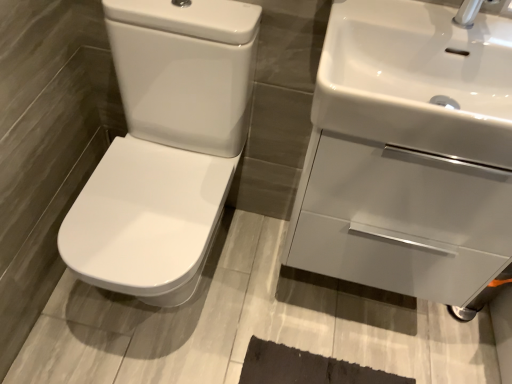
Where is `white glossy sink at upper right, which is counted as the 1th sink, starting from the front`? Image resolution: width=512 pixels, height=384 pixels. white glossy sink at upper right, which is counted as the 1th sink, starting from the front is located at coordinates (417, 80).

Where is `white glossy sink at upper right, the 2th sink viewed from the front`? The width and height of the screenshot is (512, 384). white glossy sink at upper right, the 2th sink viewed from the front is located at coordinates (408, 153).

Identify the location of white glossy sink at upper right, which is counted as the 1th sink, starting from the front. This screenshot has height=384, width=512. (417, 80).

Which object is closer to the camera, white glossy sink at upper right, which is the first sink in back-to-front order, or white glossy sink at upper right, which is counted as the 1th sink, starting from the front?

white glossy sink at upper right, which is counted as the 1th sink, starting from the front, is in front.

From the image's perspective, is white glossy sink at upper right, the 2th sink viewed from the front, located above white glossy sink at upper right, which appears as the second sink when viewed from the back?

No, from the image's perspective, white glossy sink at upper right, the 2th sink viewed from the front, is not above white glossy sink at upper right, which appears as the second sink when viewed from the back.

Where is `sink that is on the left side of white glossy sink at upper right, which is the first sink in back-to-front order`? This screenshot has width=512, height=384. sink that is on the left side of white glossy sink at upper right, which is the first sink in back-to-front order is located at coordinates (417, 80).

Is point (375, 76) more distant than point (434, 290)?

No, it is in front of (434, 290).

Does white glossy sink at upper right, which appears as the second sink when viewed from the back, have a greater height compared to white glossy sink at upper right, the 2th sink viewed from the front?

No, white glossy sink at upper right, which appears as the second sink when viewed from the back, is not taller than white glossy sink at upper right, the 2th sink viewed from the front.

Who is bigger, white glossy sink at upper right, the 2th sink viewed from the front, or white glossy toilet at left?

With larger size is white glossy toilet at left.

Measure the distance from white glossy sink at upper right, the 2th sink viewed from the front, to white glossy toilet at left.

They are 40.94 centimeters apart.

Is white glossy sink at upper right, which is the first sink in back-to-front order, facing towards white glossy toilet at left?

No, white glossy sink at upper right, which is the first sink in back-to-front order, is not aimed at white glossy toilet at left.

Consider the image. Is white glossy sink at upper right, which is the first sink in back-to-front order, taller than white glossy toilet at left?

Incorrect, the height of white glossy sink at upper right, which is the first sink in back-to-front order, is not larger of that of white glossy toilet at left.

Is white glossy toilet at left smaller than white glossy sink at upper right, which is counted as the 1th sink, starting from the front?

No.

Is white glossy toilet at left behind white glossy sink at upper right, which appears as the second sink when viewed from the back?

That is True.

Where is `toilet below the white glossy sink at upper right, which is counted as the 1th sink, starting from the front (from a real-world perspective)`? The image size is (512, 384). toilet below the white glossy sink at upper right, which is counted as the 1th sink, starting from the front (from a real-world perspective) is located at coordinates (165, 147).

From a real-world perspective, which is physically above, white glossy toilet at left or white glossy sink at upper right, which appears as the second sink when viewed from the back?

white glossy sink at upper right, which appears as the second sink when viewed from the back, is physically above.

Looking at the image, does white glossy sink at upper right, which is counted as the 1th sink, starting from the front, seem bigger or smaller compared to white glossy toilet at left?

In the image, white glossy sink at upper right, which is counted as the 1th sink, starting from the front, appears to be smaller than white glossy toilet at left.

Is there a large distance between white glossy sink at upper right, which appears as the second sink when viewed from the back, and white glossy toilet at left?

white glossy sink at upper right, which appears as the second sink when viewed from the back, is actually quite close to white glossy toilet at left.

Locate an element on the screen. The width and height of the screenshot is (512, 384). toilet below the white glossy sink at upper right, which appears as the second sink when viewed from the back (from a real-world perspective) is located at coordinates (165, 147).

How different are the orientations of white glossy sink at upper right, which appears as the second sink when viewed from the back, and white glossy toilet at left in degrees?

white glossy sink at upper right, which appears as the second sink when viewed from the back, and white glossy toilet at left are facing 0.44 degrees away from each other.

From a real-world perspective, does white glossy toilet at left stand above white glossy sink at upper right, which is the first sink in back-to-front order?

Incorrect, from a real-world perspective, white glossy toilet at left is lower than white glossy sink at upper right, which is the first sink in back-to-front order.

Considering the sizes of white glossy toilet at left and white glossy sink at upper right, which is the first sink in back-to-front order, in the image, is white glossy toilet at left taller or shorter than white glossy sink at upper right, which is the first sink in back-to-front order,?

Clearly, white glossy toilet at left is taller compared to white glossy sink at upper right, which is the first sink in back-to-front order.

Is there a large distance between white glossy toilet at left and white glossy sink at upper right, the 2th sink viewed from the front?

No, white glossy toilet at left is not far away from white glossy sink at upper right, the 2th sink viewed from the front.

From the image's perspective, would you say white glossy toilet at left is shown under white glossy sink at upper right, which is the first sink in back-to-front order?

Indeed, from the image's perspective, white glossy toilet at left is shown beneath white glossy sink at upper right, which is the first sink in back-to-front order.

This screenshot has height=384, width=512. In order to click on sink behind the white glossy sink at upper right, which is counted as the 1th sink, starting from the front in this screenshot , I will do (x=408, y=153).

Identify the location of sink to the right of white glossy sink at upper right, which is counted as the 1th sink, starting from the front. This screenshot has width=512, height=384. (408, 153).

Estimate the real-world distances between objects in this image. Which object is further from white glossy sink at upper right, the 2th sink viewed from the front, white glossy toilet at left or white glossy sink at upper right, which is counted as the 1th sink, starting from the front?

Among the two, white glossy toilet at left is located further to white glossy sink at upper right, the 2th sink viewed from the front.

When comparing their distances from white glossy toilet at left, does white glossy sink at upper right, which appears as the second sink when viewed from the back, or white glossy sink at upper right, which is the first sink in back-to-front order, seem further?

Based on the image, white glossy sink at upper right, which appears as the second sink when viewed from the back, appears to be further to white glossy toilet at left.

Considering their positions, is white glossy sink at upper right, which is counted as the 1th sink, starting from the front, positioned closer to white glossy sink at upper right, the 2th sink viewed from the front, than white glossy toilet at left?

white glossy sink at upper right, which is counted as the 1th sink, starting from the front, lies closer to white glossy sink at upper right, the 2th sink viewed from the front, than the other object.

Based on their spatial positions, is white glossy sink at upper right, the 2th sink viewed from the front, or white glossy sink at upper right, which is counted as the 1th sink, starting from the front, further from white glossy toilet at left?

white glossy sink at upper right, which is counted as the 1th sink, starting from the front.

Which object lies nearer to the anchor point white glossy sink at upper right, which appears as the second sink when viewed from the back, white glossy sink at upper right, the 2th sink viewed from the front, or white glossy toilet at left?

white glossy sink at upper right, the 2th sink viewed from the front, is closer to white glossy sink at upper right, which appears as the second sink when viewed from the back.

When comparing their distances from white glossy sink at upper right, which appears as the second sink when viewed from the back, does white glossy toilet at left or white glossy sink at upper right, the 2th sink viewed from the front, seem closer?

The object closer to white glossy sink at upper right, which appears as the second sink when viewed from the back, is white glossy sink at upper right, the 2th sink viewed from the front.

Image resolution: width=512 pixels, height=384 pixels. Find the location of `sink situated between white glossy toilet at left and white glossy sink at upper right, which is the first sink in back-to-front order, from left to right`. sink situated between white glossy toilet at left and white glossy sink at upper right, which is the first sink in back-to-front order, from left to right is located at coordinates (417, 80).